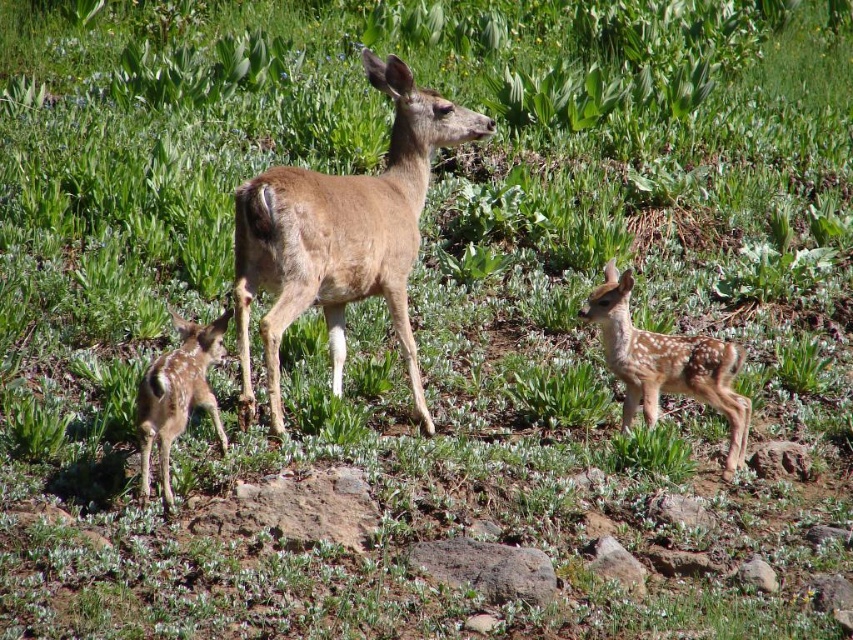
You are a wildlife photographer trying to capture a closeup of the fawns. You have a camera lens that can focus on objects up to 2 meters away. You are currently positioned 1.5 meters away from the fawn fur fawn at center. Can you also get a clear shot of the fawn fur fawn at lower left if it is 2.5 meters away from you?

The fawn fur fawn at lower left is 2.5 meters away from you, which is beyond the camera lens range of 2 meters. Therefore, you cannot get a clear shot of the fawn fur fawn at lower left.

What is located at the coordinates point [341,236] in the image?

The coordinates point [341,236] marks the location of the brown matte deer at center.

You are a photographer trying to capture a photo of the brown matte deer at center and the fawn fur fawn at center. If you want to ensure both are in focus, which deer should you focus on first to account for their size difference?

The brown matte deer at center is much taller than the fawn fur fawn at center, so you should focus on the brown matte deer at center first since it is larger and might require more precise focus to capture details.